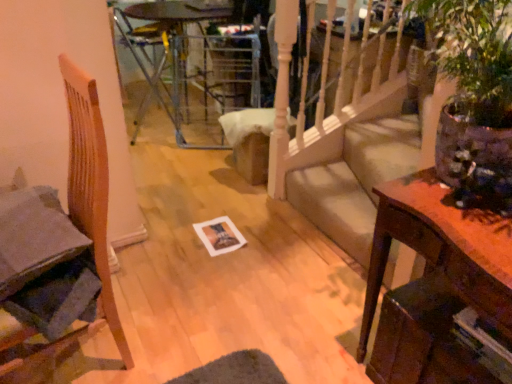
Question: Relative to transparent glass table at center, is wooden chair at left in front or behind?

Choices:
 (A) behind
 (B) front

Answer: (B)

Question: Is wooden chair at left bigger or smaller than transparent glass table at center?

Choices:
 (A) small
 (B) big

Answer: (A)

Question: Which of these objects is positioned farthest from the wooden side table at right?

Choices:
 (A) wooden chair at left
 (B) beige fabric couch at center
 (C) matte paper magazine at lower right
 (D) transparent glass table at center
 (E) metallic silver armchair at upper center

Answer: (E)

Question: Which is nearer to the transparent glass table at center?

Choices:
 (A) matte paper magazine at lower right
 (B) wooden side table at right
 (C) wooden chair at left
 (D) beige fabric couch at center
 (E) metallic silver armchair at upper center

Answer: (E)